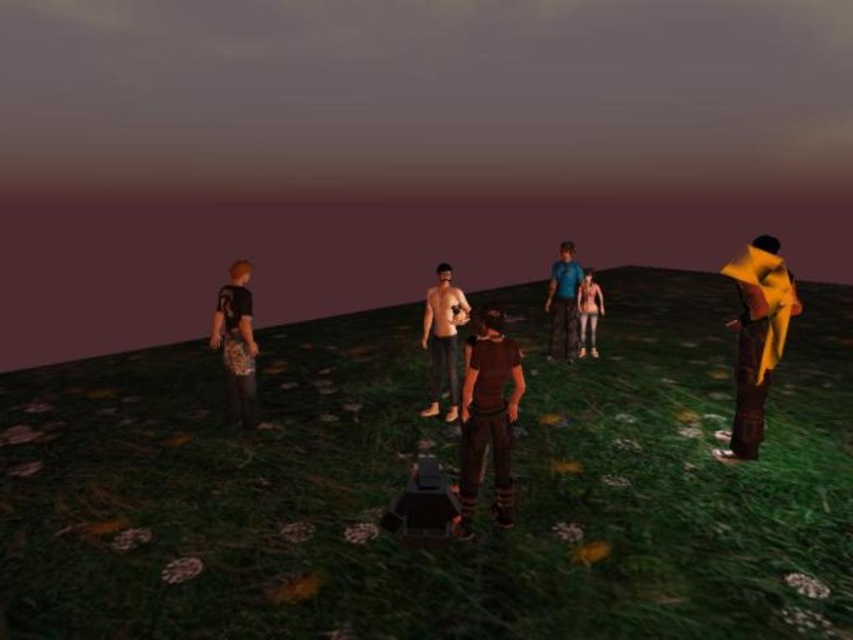
Question: Considering the relative positions of brown matte shirt at center and blue fabric shirt at center in the image provided, where is brown matte shirt at center located with respect to blue fabric shirt at center?

Choices:
 (A) right
 (B) left

Answer: (B)

Question: Is leopard print pants at left further to camera compared to leather jacket at center?

Choices:
 (A) no
 (B) yes

Answer: (A)

Question: Can you confirm if yellow fabric coat at right is positioned above brown matte shirt at center?

Choices:
 (A) yes
 (B) no

Answer: (A)

Question: Which object is farther from the camera taking this photo?

Choices:
 (A) blue fabric shirt at center
 (B) leather jacket at center

Answer: (B)

Question: Which point is farther to the camera?

Choices:
 (A) click(x=225, y=356)
 (B) click(x=453, y=304)
 (C) click(x=738, y=419)
 (D) click(x=410, y=580)

Answer: (B)

Question: Which of the following is the farthest from the observer?

Choices:
 (A) (456, 410)
 (B) (585, 292)

Answer: (B)